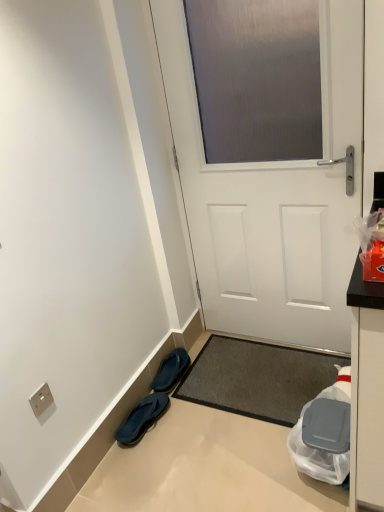
The height and width of the screenshot is (512, 384). What are the coordinates of `free space above dark gray textured mat at center (from a real-world perspective)` in the screenshot? It's located at (260, 375).